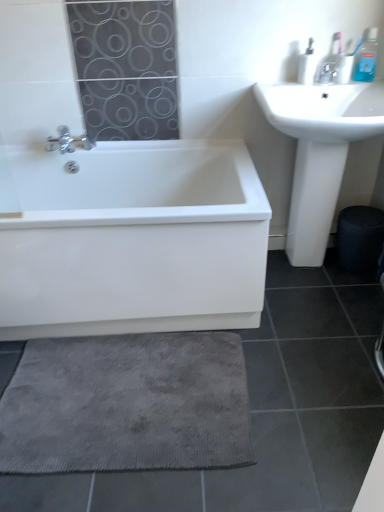
The width and height of the screenshot is (384, 512). Describe the element at coordinates (319, 151) in the screenshot. I see `white glossy sink at upper right` at that location.

What do you see at coordinates (134, 240) in the screenshot? I see `white glossy bathtub at lower left` at bounding box center [134, 240].

Describe the element at coordinates (328, 72) in the screenshot. This screenshot has height=512, width=384. I see `satin nickel faucet at upper right` at that location.

The height and width of the screenshot is (512, 384). What do you see at coordinates (366, 57) in the screenshot?
I see `blue plastic toothbrush at upper right, the second toiletry positioned from the left` at bounding box center [366, 57].

Image resolution: width=384 pixels, height=512 pixels. Identify the location of white plastic soap dispenser at upper right, which ranks as the first toiletry in left-to-right order. (307, 65).

Looking at this image, what is the approximate width of white plastic soap dispenser at upper right, which ranks as the second toiletry in right-to-left order?

The width of white plastic soap dispenser at upper right, which ranks as the second toiletry in right-to-left order, is 3.07 inches.

You are a GUI agent. You are given a task and a screenshot of the screen. Output one action in this format:
    pyautogui.click(x=<x>, y=<y>)
    Task: Click on the gray textured bath mat at lower center
    
    Given the screenshot: What is the action you would take?
    pyautogui.click(x=127, y=404)

Considering the positions of point (366, 57) and point (302, 60), is point (366, 57) closer or farther from the camera than point (302, 60)?

Point (366, 57) appears to be closer to the viewer than point (302, 60).

Which of these two, blue plastic toothbrush at upper right, the first toiletry in the right-to-left sequence, or white plastic soap dispenser at upper right, which ranks as the first toiletry in left-to-right order, is thinner?

With smaller width is blue plastic toothbrush at upper right, the first toiletry in the right-to-left sequence.

Is blue plastic toothbrush at upper right, the second toiletry positioned from the left, turned away from white plastic soap dispenser at upper right, which ranks as the second toiletry in right-to-left order?

No, blue plastic toothbrush at upper right, the second toiletry positioned from the left, is not facing away from white plastic soap dispenser at upper right, which ranks as the second toiletry in right-to-left order.

Image resolution: width=384 pixels, height=512 pixels. I want to click on toiletry lying above the white plastic soap dispenser at upper right, which ranks as the first toiletry in left-to-right order (from the image's perspective), so click(x=366, y=57).

Does gray textured bath mat at lower center come in front of blue plastic toothbrush at upper right, the second toiletry positioned from the left?

That is True.

Can you see gray textured bath mat at lower center touching blue plastic toothbrush at upper right, the first toiletry in the right-to-left sequence?

No.

Which of these two, gray textured bath mat at lower center or blue plastic toothbrush at upper right, the first toiletry in the right-to-left sequence, stands taller?

With more height is blue plastic toothbrush at upper right, the first toiletry in the right-to-left sequence.

How many degrees apart are the facing directions of gray textured bath mat at lower center and blue plastic toothbrush at upper right, the first toiletry in the right-to-left sequence?

The angle between the facing direction of gray textured bath mat at lower center and the facing direction of blue plastic toothbrush at upper right, the first toiletry in the right-to-left sequence, is 5.55 degrees.

How many degrees apart are the facing directions of gray textured bath mat at lower center and satin nickel faucet at upper right?

The angular difference between gray textured bath mat at lower center and satin nickel faucet at upper right is 4.14 degrees.

Is gray textured bath mat at lower center further to the viewer compared to satin nickel faucet at upper right?

No, gray textured bath mat at lower center is closer to the camera.

Who is bigger, gray textured bath mat at lower center or satin nickel faucet at upper right?

gray textured bath mat at lower center is bigger.

From the image's perspective, is gray textured bath mat at lower center positioned above or below satin nickel faucet at upper right?

Based on their image positions, gray textured bath mat at lower center is located beneath satin nickel faucet at upper right.

From a real-world perspective, is blue plastic toothbrush at upper right, the first toiletry in the right-to-left sequence, positioned under satin nickel faucet at upper right based on gravity?

No, from a real-world perspective, blue plastic toothbrush at upper right, the first toiletry in the right-to-left sequence, is not under satin nickel faucet at upper right.

Between blue plastic toothbrush at upper right, the first toiletry in the right-to-left sequence, and satin nickel faucet at upper right, which one has smaller size?

With smaller size is satin nickel faucet at upper right.

Could you measure the distance between blue plastic toothbrush at upper right, the first toiletry in the right-to-left sequence, and satin nickel faucet at upper right?

4.76 inches.

Looking at this image, is blue plastic toothbrush at upper right, the second toiletry positioned from the left, aimed at satin nickel faucet at upper right?

No, blue plastic toothbrush at upper right, the second toiletry positioned from the left, is not facing towards satin nickel faucet at upper right.

Considering the relative sizes of blue plastic toothbrush at upper right, the first toiletry in the right-to-left sequence, and gray textured bath mat at lower center in the image provided, is blue plastic toothbrush at upper right, the first toiletry in the right-to-left sequence, smaller than gray textured bath mat at lower center?

Yes.

Would you consider blue plastic toothbrush at upper right, the first toiletry in the right-to-left sequence, to be distant from gray textured bath mat at lower center?

Absolutely, blue plastic toothbrush at upper right, the first toiletry in the right-to-left sequence, is distant from gray textured bath mat at lower center.

Consider the image. Is blue plastic toothbrush at upper right, the second toiletry positioned from the left, taller than gray textured bath mat at lower center?

Yes, blue plastic toothbrush at upper right, the second toiletry positioned from the left, is taller than gray textured bath mat at lower center.

Considering the positions of objects blue plastic toothbrush at upper right, the first toiletry in the right-to-left sequence, and gray textured bath mat at lower center in the image provided, who is more to the right, blue plastic toothbrush at upper right, the first toiletry in the right-to-left sequence, or gray textured bath mat at lower center?

From the viewer's perspective, blue plastic toothbrush at upper right, the first toiletry in the right-to-left sequence, appears more on the right side.

From a real-world perspective, relative to white glossy bathtub at lower left, is white glossy sink at upper right vertically above or below?

Clearly, from a real-world perspective, white glossy sink at upper right is above white glossy bathtub at lower left.

Considering the points (293, 258) and (136, 147), which point is behind, point (293, 258) or point (136, 147)?

The point (293, 258) is behind.

Could white glossy bathtub at lower left be considered to be inside white glossy sink at upper right?

No, white glossy bathtub at lower left is not inside white glossy sink at upper right.

From a real-world perspective, is gray textured bath mat at lower center above or below white glossy sink at upper right?

gray textured bath mat at lower center is situated lower than white glossy sink at upper right in the real world.

In the image, is gray textured bath mat at lower center on the left side or the right side of white glossy sink at upper right?

In the image, gray textured bath mat at lower center appears on the left side of white glossy sink at upper right.

In the image, is gray textured bath mat at lower center positioned in front of or behind white glossy sink at upper right?

Clearly, gray textured bath mat at lower center is in front of white glossy sink at upper right.

From the image's perspective, between gray textured bath mat at lower center and white glossy sink at upper right, who is located below?

gray textured bath mat at lower center is shown below in the image.

Where is `toiletry above the white plastic soap dispenser at upper right, which ranks as the first toiletry in left-to-right order (from a real-world perspective)`? Image resolution: width=384 pixels, height=512 pixels. toiletry above the white plastic soap dispenser at upper right, which ranks as the first toiletry in left-to-right order (from a real-world perspective) is located at coordinates (366, 57).

From the image's perspective, starting from the gray textured bath mat at lower center, which toiletry is the 2nd one above? Please provide its 2D coordinates.

[(366, 57)]

Considering their positions, is white glossy bathtub at lower left positioned closer to white glossy sink at upper right than white plastic soap dispenser at upper right, which ranks as the second toiletry in right-to-left order?

white plastic soap dispenser at upper right, which ranks as the second toiletry in right-to-left order.

Considering their positions, is gray textured bath mat at lower center positioned closer to white plastic soap dispenser at upper right, which ranks as the first toiletry in left-to-right order, than satin nickel faucet at upper right?

The object closer to white plastic soap dispenser at upper right, which ranks as the first toiletry in left-to-right order, is satin nickel faucet at upper right.

Which object lies nearer to the anchor point white plastic soap dispenser at upper right, which ranks as the second toiletry in right-to-left order, white glossy bathtub at lower left or satin nickel faucet at upper right?

Based on the image, satin nickel faucet at upper right appears to be nearer to white plastic soap dispenser at upper right, which ranks as the second toiletry in right-to-left order.

From the image, which object appears to be nearer to gray textured bath mat at lower center, blue plastic toothbrush at upper right, the second toiletry positioned from the left, or satin nickel faucet at upper right?

satin nickel faucet at upper right.

Looking at the image, which one is located closer to blue plastic toothbrush at upper right, the first toiletry in the right-to-left sequence, white glossy bathtub at lower left or white glossy sink at upper right?

white glossy sink at upper right is closer to blue plastic toothbrush at upper right, the first toiletry in the right-to-left sequence.

Based on their spatial positions, is white plastic soap dispenser at upper right, which ranks as the first toiletry in left-to-right order, or white glossy bathtub at lower left closer to satin nickel faucet at upper right?

Among the two, white plastic soap dispenser at upper right, which ranks as the first toiletry in left-to-right order, is located nearer to satin nickel faucet at upper right.

Which object lies further to the anchor point white glossy sink at upper right, white plastic soap dispenser at upper right, which ranks as the first toiletry in left-to-right order, or blue plastic toothbrush at upper right, the second toiletry positioned from the left?

blue plastic toothbrush at upper right, the second toiletry positioned from the left, is positioned further to the anchor white glossy sink at upper right.

When comparing their distances from satin nickel faucet at upper right, does gray textured bath mat at lower center or white plastic soap dispenser at upper right, which ranks as the second toiletry in right-to-left order, seem closer?

Among the two, white plastic soap dispenser at upper right, which ranks as the second toiletry in right-to-left order, is located nearer to satin nickel faucet at upper right.

Image resolution: width=384 pixels, height=512 pixels. I want to click on tap between white plastic soap dispenser at upper right, which ranks as the second toiletry in right-to-left order, and gray textured bath mat at lower center vertically, so pyautogui.click(x=328, y=72).

Identify the location of toiletry located between white glossy bathtub at lower left and blue plastic toothbrush at upper right, the second toiletry positioned from the left, in the left-right direction. This screenshot has width=384, height=512. (307, 65).

Where is `sink that lies between blue plastic toothbrush at upper right, the second toiletry positioned from the left, and gray textured bath mat at lower center from top to bottom`? The height and width of the screenshot is (512, 384). sink that lies between blue plastic toothbrush at upper right, the second toiletry positioned from the left, and gray textured bath mat at lower center from top to bottom is located at coordinates (319, 151).

Locate an element on the screen. The height and width of the screenshot is (512, 384). sink between satin nickel faucet at upper right and gray textured bath mat at lower center in the up-down direction is located at coordinates (319, 151).